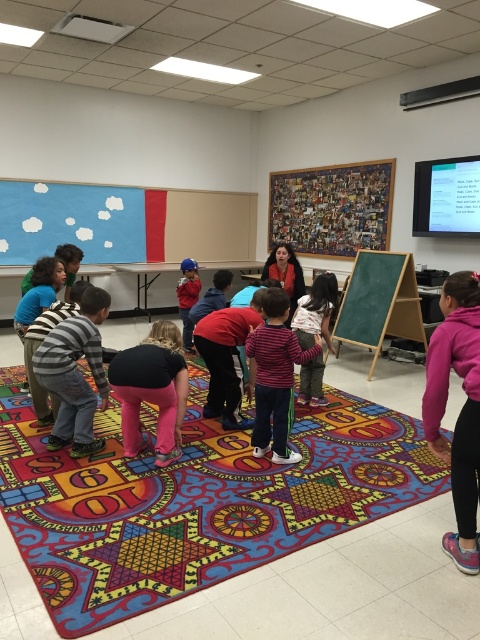
You are a student sitting on the multicolored carpet at center and want to hand a paper to the student wearing the striped cotton shirt at center. Can you reach them without moving from your seat?

The multicolored carpet at center is closer to the viewer than the striped cotton shirt at center, so you can reach them without moving from your seat.

You are standing at the entrance of the classroom and want to step onto the multicolored carpet at center. Based on its position, can you estimate whether the carpet is closer to the left wall or the right wall?

The multicolored carpet at center is located at point 0.784 on the x and y axis, which means it is closer to the right wall than the left wall.